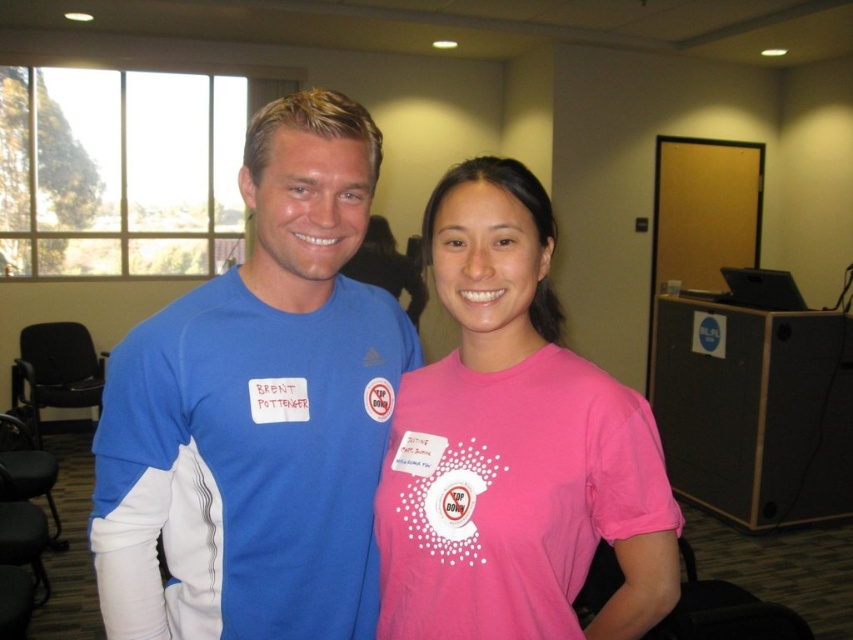
Question: Does blue fabric shirt at left appear over pink matte shirt at center?

Choices:
 (A) yes
 (B) no

Answer: (A)

Question: Which point is farther to the camera?

Choices:
 (A) blue fabric shirt at left
 (B) pink matte shirt at center

Answer: (A)

Question: Can you confirm if blue fabric shirt at left is smaller than pink matte shirt at center?

Choices:
 (A) no
 (B) yes

Answer: (A)

Question: Does blue fabric shirt at left have a larger size compared to pink matte shirt at center?

Choices:
 (A) no
 (B) yes

Answer: (B)